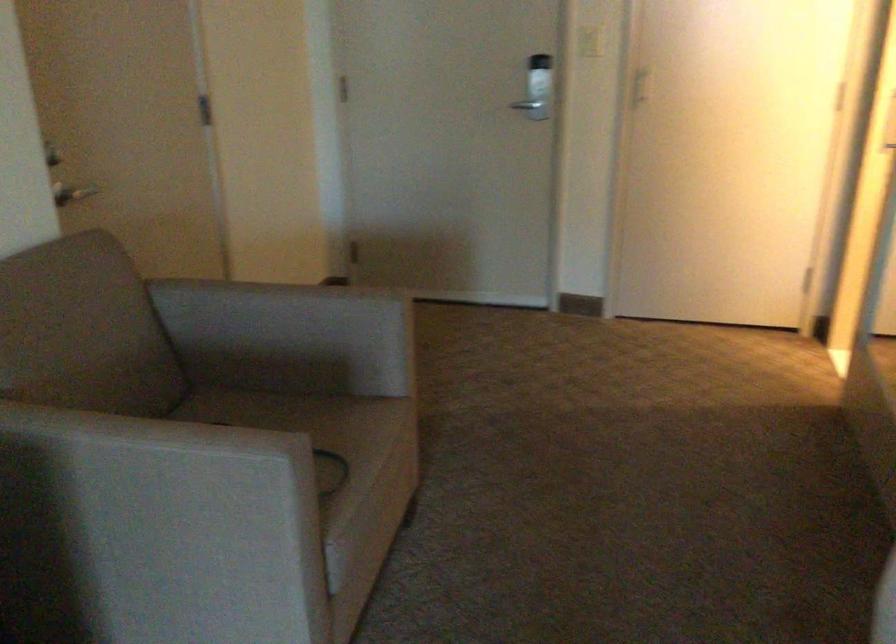
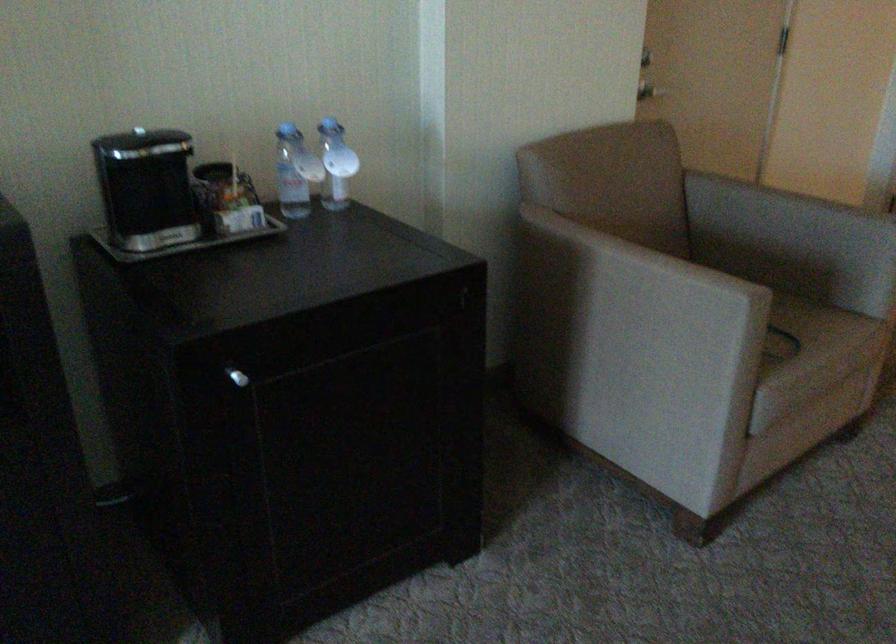
Locate, in the second image, the point that corresponds to (70,207) in the first image.

(649, 90)